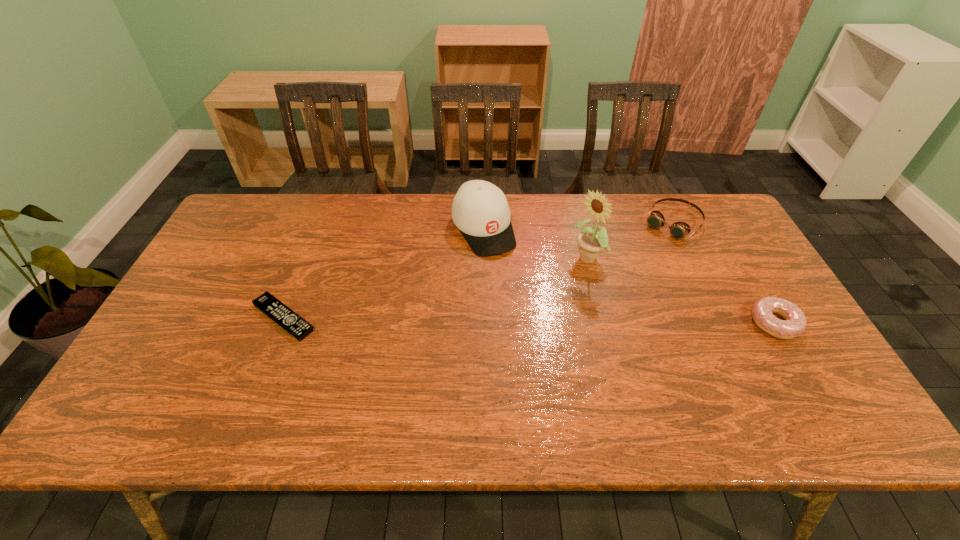
Identify the location of remote control. click(x=290, y=321).

You are a GUI agent. You are given a task and a screenshot of the screen. Output one action in this format:
    pyautogui.click(x=<x>, y=<y>)
    Task: Click on the leftmost object
    
    Given the screenshot: What is the action you would take?
    pyautogui.click(x=290, y=321)

The height and width of the screenshot is (540, 960). I want to click on doughnut, so click(794, 323).

Where is `the second tallest object`? the second tallest object is located at coordinates (480, 210).

What are the coordinates of `the fourth object from right to left` in the screenshot? It's located at click(x=480, y=210).

The height and width of the screenshot is (540, 960). What are the coordinates of `sunflower` in the screenshot? It's located at (591, 242).

Locate an element on the screen. This screenshot has height=540, width=960. the tallest object is located at coordinates (591, 242).

You are a GUI agent. You are given a task and a screenshot of the screen. Output one action in this format:
    pyautogui.click(x=<x>, y=<y>)
    Task: Click on the goggles
    
    Given the screenshot: What is the action you would take?
    pyautogui.click(x=678, y=230)

You are a GUI agent. You are given a task and a screenshot of the screen. Output one action in this format:
    pyautogui.click(x=<x>, y=<y>)
    Task: Click on the free location located on the back of the leftmost object
    
    Given the screenshot: What is the action you would take?
    pyautogui.click(x=326, y=209)

Locate an element on the screen. The width and height of the screenshot is (960, 540). vacant space located on the left of the doughnut is located at coordinates (666, 323).